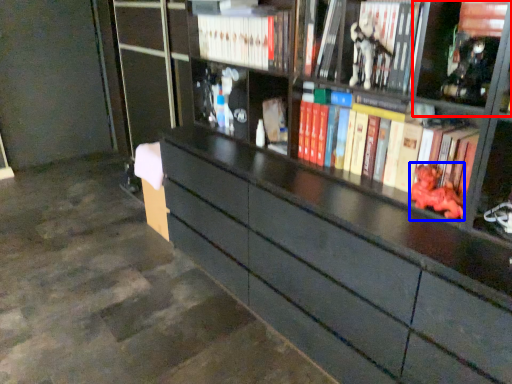
Question: Which point is closer to the camera, cabinet (highlighted by a red box) or toy (highlighted by a blue box)?

Choices:
 (A) cabinet
 (B) toy

Answer: (A)